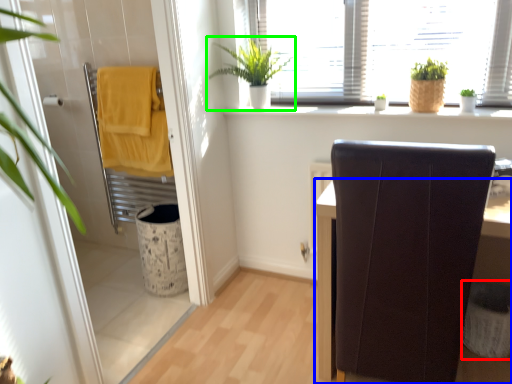
Question: Considering the real-world distances, which object is closest to laundry basket (highlighted by a red box)? furniture (highlighted by a blue box) or houseplant (highlighted by a green box).

Choices:
 (A) furniture
 (B) houseplant

Answer: (A)